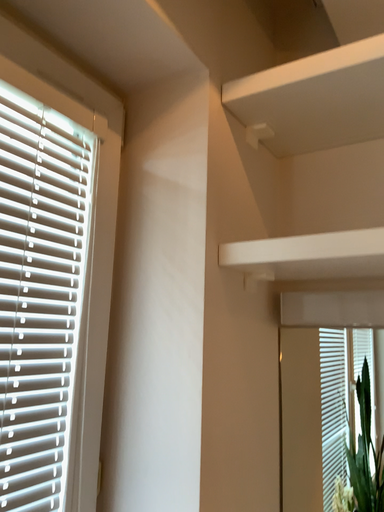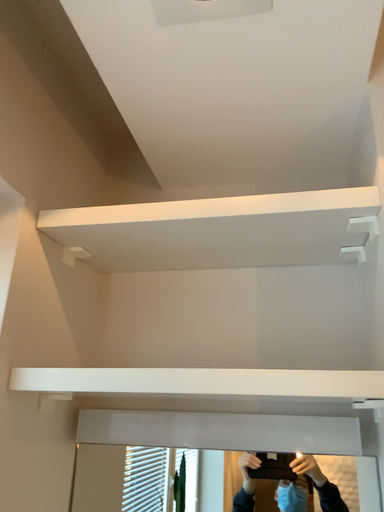
Question: Which way did the camera rotate in the video?

Choices:
 (A) rotated downward
 (B) rotated upward

Answer: (B)